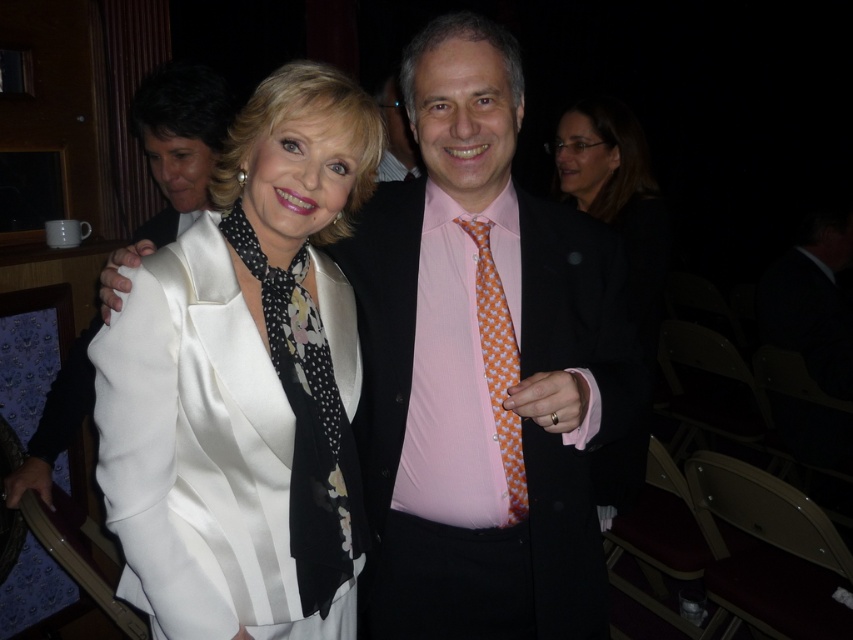
Question: Considering the relative positions of satin white suit at center and matte black jacket at upper right in the image provided, where is satin white suit at center located with respect to matte black jacket at upper right?

Choices:
 (A) right
 (B) left

Answer: (B)

Question: Which point is closer to the camera taking this photo?

Choices:
 (A) (424, 216)
 (B) (410, 132)
 (C) (375, 420)

Answer: (A)

Question: In this image, where is satin white suit at center located relative to matte black suit at center?

Choices:
 (A) left
 (B) right

Answer: (A)

Question: Which of the following is the closest to the observer?

Choices:
 (A) matte black suit at center
 (B) pink satin suit at center

Answer: (A)

Question: Which of the following is the closest to the observer?

Choices:
 (A) matte black suit at center
 (B) satin white dress at center
 (C) pink satin suit at center

Answer: (B)

Question: Can you confirm if matte black suit at center is wider than orange printed tie at center?

Choices:
 (A) no
 (B) yes

Answer: (B)